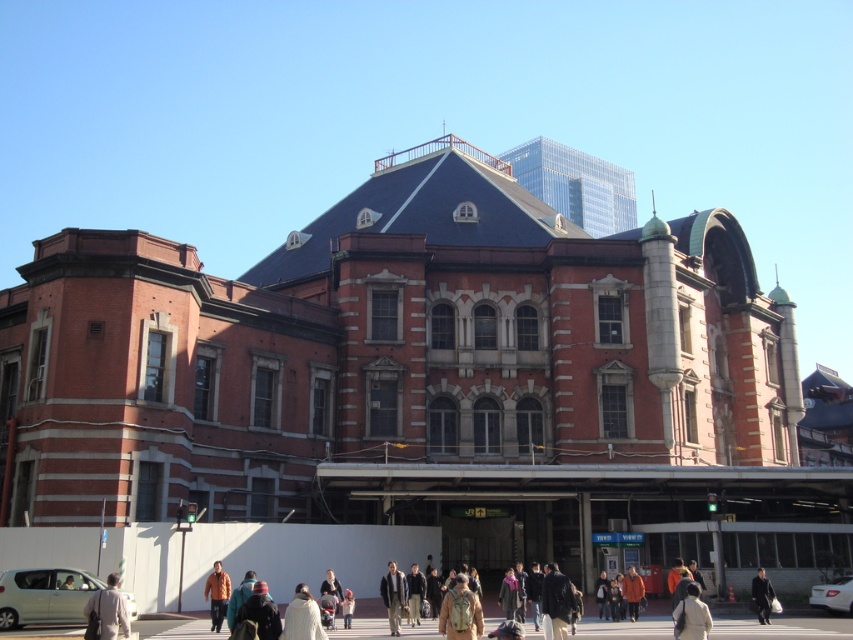
Who is lower down, tan fabric backpack at center or dark brown leather jacket at center?

dark brown leather jacket at center

Who is more forward, (459, 612) or (553, 608)?

Positioned in front is point (459, 612).

Does point (480, 609) lie behind point (544, 596)?

No, (480, 609) is closer to viewer.

Locate an element on the screen. This screenshot has width=853, height=640. tan fabric backpack at center is located at coordinates (460, 611).

Does white wool coat at center appear over orange jacket at lower center?

Yes, white wool coat at center is above orange jacket at lower center.

Who is more forward, (x=305, y=618) or (x=212, y=611)?

Positioned in front is point (x=305, y=618).

Where is `white wool coat at center`? white wool coat at center is located at coordinates (302, 616).

Can you confirm if dark blue jacket at center is positioned below orange jacket at center?

Result: Yes.

Who is higher up, dark blue jacket at center or orange jacket at center?

orange jacket at center

Does point (759, 621) come in front of point (625, 580)?

That is True.

Where is `dark blue jacket at center`? This screenshot has height=640, width=853. dark blue jacket at center is located at coordinates (761, 595).